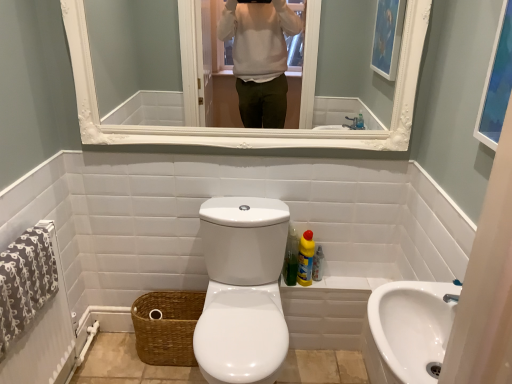
Question: Is point (431, 306) closer or farther from the camera than point (210, 367)?

Choices:
 (A) farther
 (B) closer

Answer: (B)

Question: Is white glossy sink at lower right situated inside white glossy toilet at center or outside?

Choices:
 (A) inside
 (B) outside

Answer: (B)

Question: Estimate the real-world distances between objects in this image. Which object is closer to the white glossy mirror at upper center?

Choices:
 (A) brown woven basket at lower left
 (B) white glossy toilet at center
 (C) translucent plastic bottle at lower right
 (D) blue glass picture frame at upper right
 (E) white glossy sink at lower right

Answer: (A)

Question: Estimate the real-world distances between objects in this image. Which object is farther from the white glossy sink at lower right?

Choices:
 (A) white glossy toilet at center
 (B) white glossy mirror at upper center
 (C) brown woven basket at lower left
 (D) translucent plastic bottle at lower right
 (E) yellow liquid cleaner at lower right

Answer: (B)